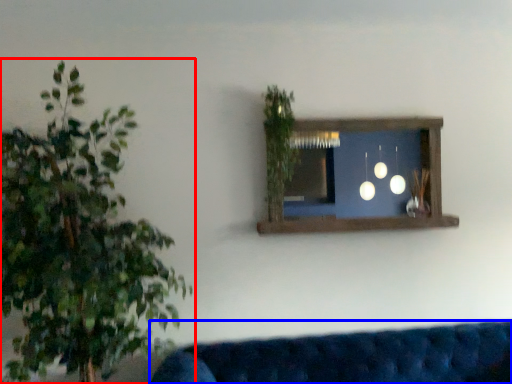
Question: Which point is further to the camera, houseplant (highlighted by a red box) or studio couch (highlighted by a blue box)?

Choices:
 (A) houseplant
 (B) studio couch

Answer: (B)